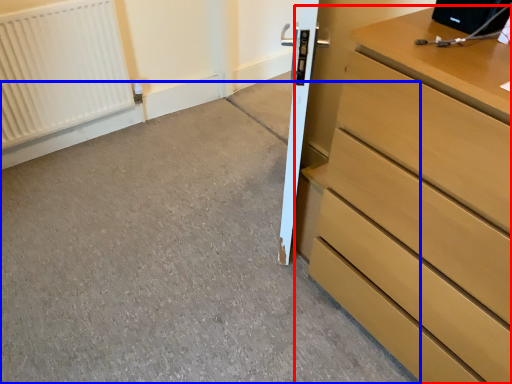
Question: Among these objects, which one is farthest to the camera, chest of drawers (highlighted by a red box) or concrete (highlighted by a blue box)?

Choices:
 (A) chest of drawers
 (B) concrete

Answer: (B)